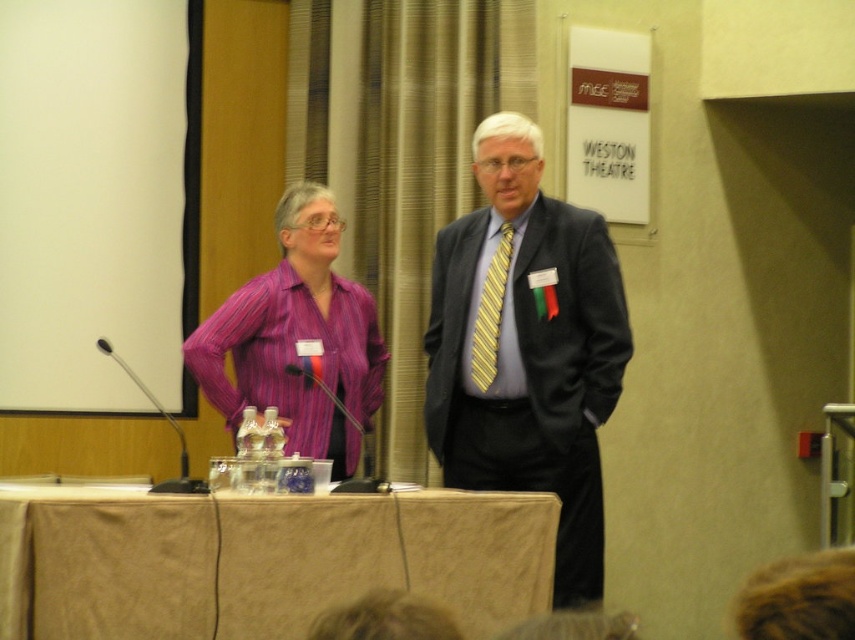
Based on the photo, you are standing in front of the podium at the conference. You need to place a small name tag on the beige fabric table at lower center. Where exactly should you place it so that it doesn not obstruct the view of the audience? Please provide coordinates in the format of point coordinates like point[263,561].

The beige fabric table at lower center is located at point[263,561]. To ensure it doesn not obstruct the audience view, place the name tag slightly to the right of this coordinate, perhaps at point0.9, 0.31.

You are an event organizer who needs to place a name tag holder on the podium. The name tag holder requires a flat surface that is behind the yellow striped tie at center. Is the beige fabric table at lower center suitable for this purpose?

The beige fabric table at lower center is in front of the yellow striped tie at center, so it cannot be used as a flat surface behind the yellow striped tie at center. You should look for another surface located behind the yellow striped tie at center.